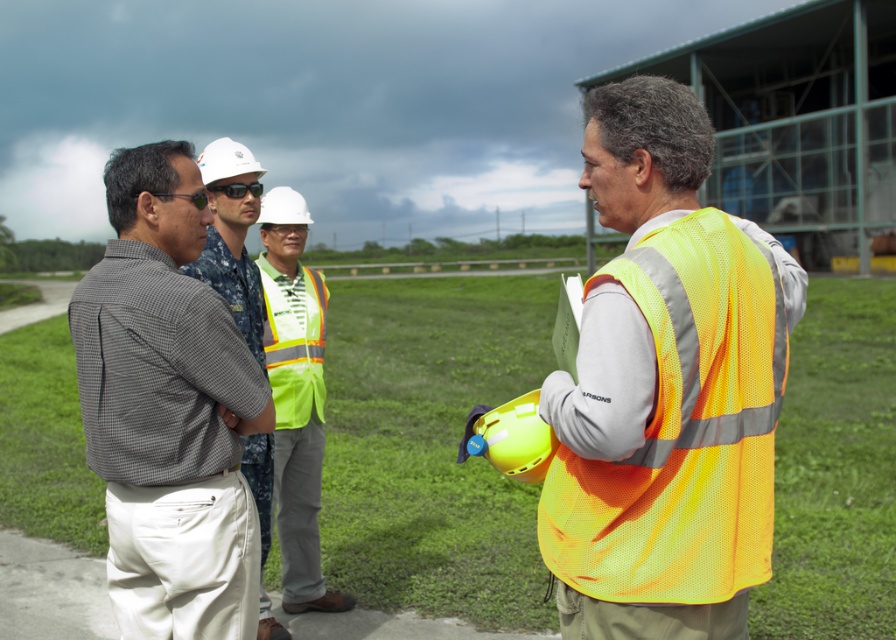
Locate an element on the screen. neon yellow safety vest at center is located at coordinates (666, 388).

Does neon yellow safety vest at center have a lesser width compared to neon yellow reflective safety vest at center?

Incorrect, neon yellow safety vest at center's width is not less than neon yellow reflective safety vest at center's.

Which is behind, point (589, 488) or point (317, 317)?

The point (317, 317) is behind.

Where is `neon yellow safety vest at center`? neon yellow safety vest at center is located at coordinates (666, 388).

Looking at this image, does matte gray shirt at center appear on the left side of neon yellow reflective safety vest at center?

Yes, matte gray shirt at center is to the left of neon yellow reflective safety vest at center.

Can you confirm if matte gray shirt at center is positioned above neon yellow reflective safety vest at center?

Incorrect, matte gray shirt at center is not positioned above neon yellow reflective safety vest at center.

Which is behind, point (254, 278) or point (280, 312)?

Positioned behind is point (280, 312).

In order to click on matte gray shirt at center in this screenshot , I will do `click(234, 268)`.

Can you confirm if reflective yellow safety vest at center is positioned to the left of neon yellow reflective safety vest at center?

Yes, reflective yellow safety vest at center is to the left of neon yellow reflective safety vest at center.

Is reflective yellow safety vest at center shorter than neon yellow reflective safety vest at center?

No.

In order to click on reflective yellow safety vest at center in this screenshot , I will do `click(295, 397)`.